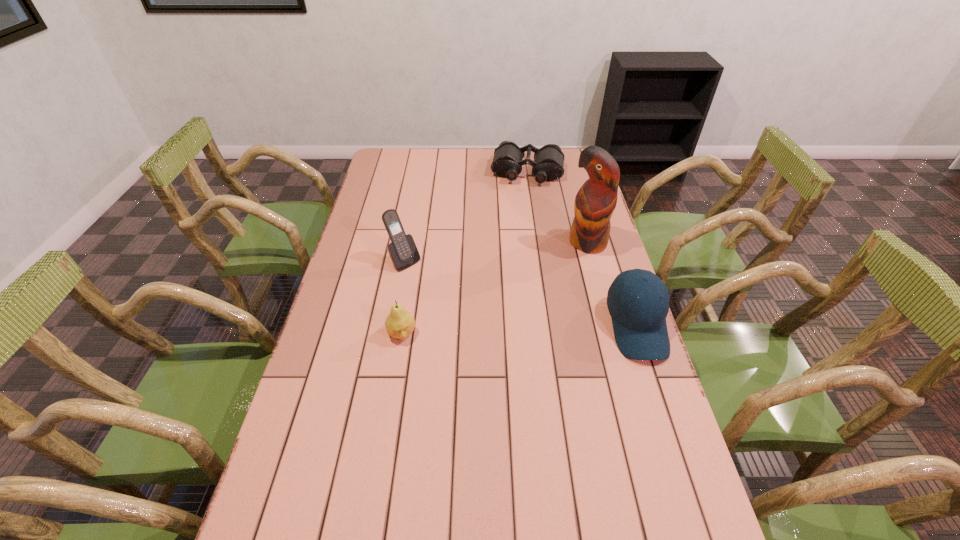
Where is `parrot located in the right edge section of the desktop`? Image resolution: width=960 pixels, height=540 pixels. parrot located in the right edge section of the desktop is located at coordinates (595, 202).

Identify the location of binoculars that is at the right edge. [548, 165].

Image resolution: width=960 pixels, height=540 pixels. I want to click on object present at the far right corner, so click(x=548, y=165).

This screenshot has height=540, width=960. I want to click on vacant space at the far edge of the desktop, so click(x=492, y=158).

I want to click on vacant space at the near edge of the desktop, so click(451, 529).

Identify the location of vacant space at the left edge. This screenshot has width=960, height=540. (327, 353).

Locate an element on the screen. This screenshot has width=960, height=540. free region at the right edge of the desktop is located at coordinates (576, 267).

In the image, there is a desktop. At what (x,y) coordinates should I click in order to perform the action: click on vacant region at the far left corner. Please return your answer as a coordinate pair (x, y). Looking at the image, I should click on (414, 156).

This screenshot has width=960, height=540. Find the location of `free spot between the farthest object and the tallest object`. free spot between the farthest object and the tallest object is located at coordinates (558, 207).

Identify the location of empty space that is in between the cellular telephone and the tallest object. The image size is (960, 540). (496, 252).